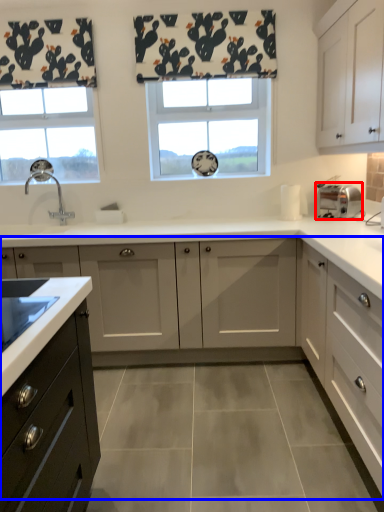
Question: Which object is closer to the camera taking this photo, toaster (highlighted by a red box) or cabinetry (highlighted by a blue box)?

Choices:
 (A) toaster
 (B) cabinetry

Answer: (B)